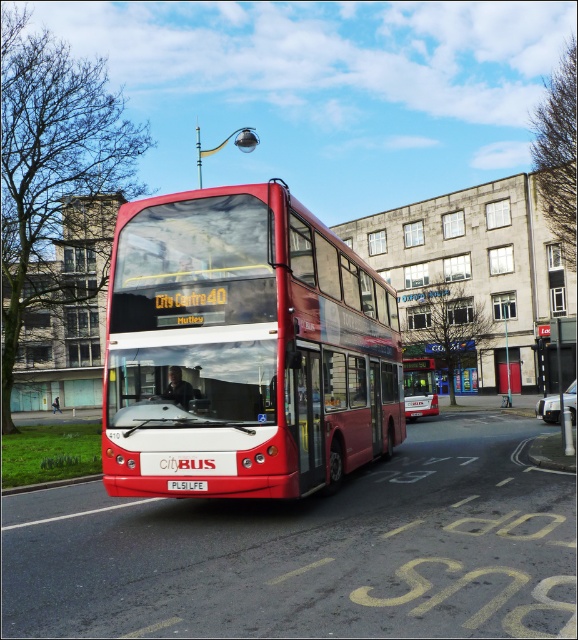
Does matte red bus at center appear on the right side of white plastic license plate at center?

Yes, matte red bus at center is to the right of white plastic license plate at center.

Consider the image. Between matte red bus at center and white plastic license plate at center, which one appears on the left side from the viewer's perspective?

From the viewer's perspective, white plastic license plate at center appears more on the left side.

Where is `matte red bus at center`? The image size is (578, 640). matte red bus at center is located at coordinates (420, 387).

At what (x,y) coordinates should I click in order to perform the action: click on matte red bus at center. Please return your answer as a coordinate pair (x, y). The image size is (578, 640). Looking at the image, I should click on (420, 387).

Who is positioned more to the left, shiny red bus at center or matte red bus at center?

shiny red bus at center is more to the left.

Which is more to the right, shiny red bus at center or matte red bus at center?

From the viewer's perspective, matte red bus at center appears more on the right side.

Does point (327, 417) come in front of point (427, 368)?

Yes, point (327, 417) is in front of point (427, 368).

You are a GUI agent. You are given a task and a screenshot of the screen. Output one action in this format:
    pyautogui.click(x=<x>, y=<y>)
    Task: Click on the shiny red bus at center
    The height and width of the screenshot is (640, 578).
    Given the screenshot: What is the action you would take?
    pyautogui.click(x=243, y=348)

Who is shorter, matte red bus at center or metallic silver car at center?

With less height is matte red bus at center.

Identify the location of matte red bus at center. This screenshot has height=640, width=578. (x=420, y=387).

Locate an element on the screen. The image size is (578, 640). matte red bus at center is located at coordinates (420, 387).